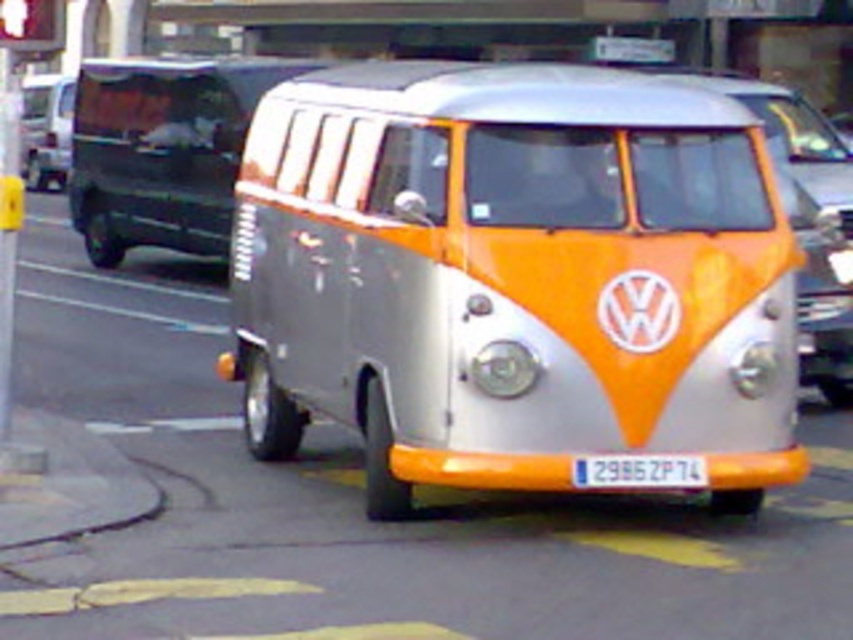
Question: Which of the following is the closest to the observer?

Choices:
 (A) silver metallic van at center
 (B) white plastic license plate at center
 (C) metallic silver van at center

Answer: (B)

Question: Where is silver metallic van at center located in relation to white plastic license plate at center in the image?

Choices:
 (A) left
 (B) right

Answer: (A)

Question: Among these points, which one is farthest from the camera?

Choices:
 (A) (802, 384)
 (B) (368, 273)

Answer: (A)

Question: Does metallic silver van at center have a lesser width compared to white plastic license plate at center?

Choices:
 (A) no
 (B) yes

Answer: (A)

Question: Estimate the real-world distances between objects in this image. Which object is closer to the metallic silver van at center?

Choices:
 (A) silver metallic van at center
 (B) white plastic license plate at center

Answer: (A)

Question: Does silver metallic van at center have a larger size compared to metallic silver van at center?

Choices:
 (A) no
 (B) yes

Answer: (B)